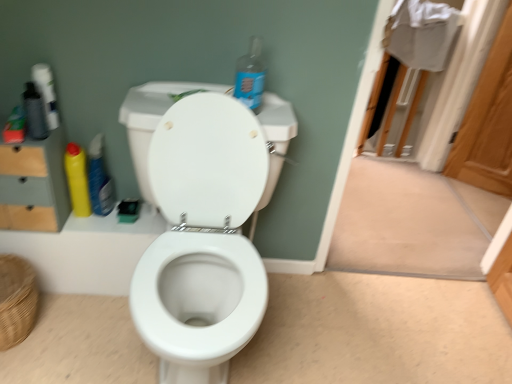
The image size is (512, 384). In order to click on vacant space positioned to the left of wooden screen door at upper right in this screenshot , I will do `click(457, 184)`.